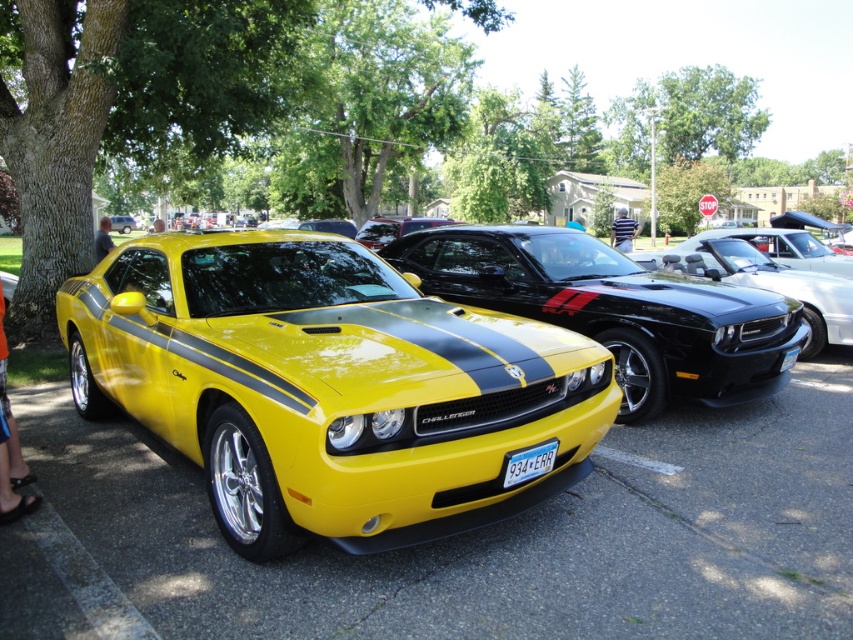
You are a photographer trying to capture the yellow glossy dodge challenger at center and the white plastic license plate at center in a single shot. Since the camera can only focus on one object at a time, which object should you focus on first to ensure the other remains in the background?

The yellow glossy dodge challenger at center is located above the white plastic license plate at center, so you should focus on the yellow glossy dodge challenger at center first to keep the white plastic license plate at center in the background.

You are a photographer trying to capture the shiny yellow muscle car at center and the white plastic license plate at center in a single shot. Since you want both to be clearly visible, which object should you ensure is closer to the camera to avoid blurring?

The shiny yellow muscle car at center is larger in size than the white plastic license plate at center, so to ensure both are clearly visible, you should position the shiny yellow muscle car at center closer to the camera. This way, the larger object won